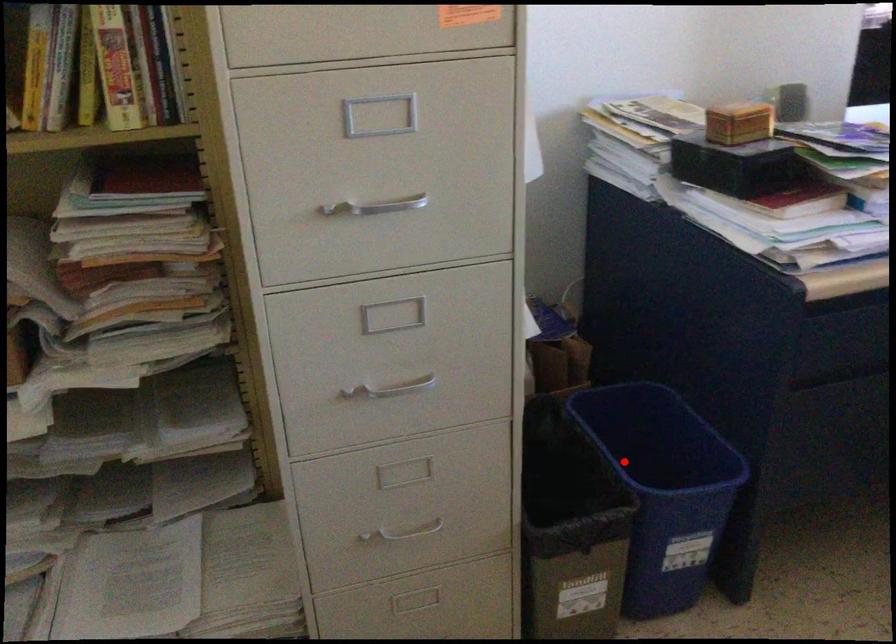
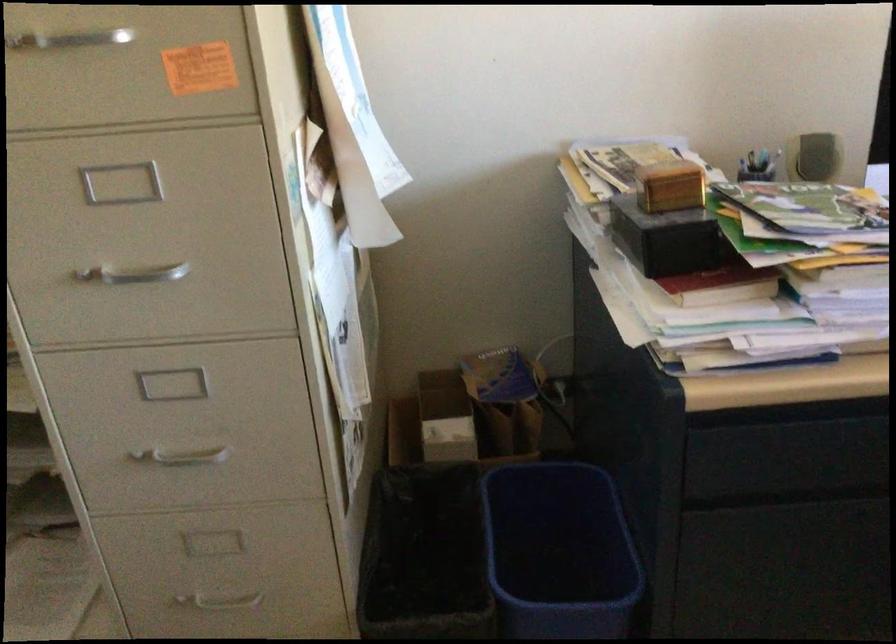
Where in the second image is the point corresponding to the highlighted location from the first image?

(558, 552)